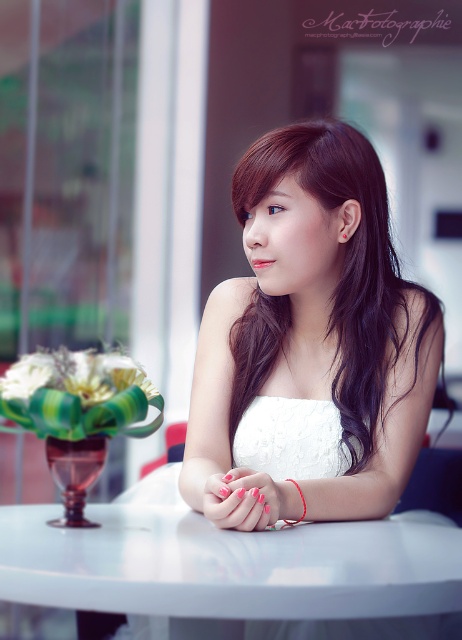
Question: Does white glossy table at center appear on the left side of red string bracelet at center?

Choices:
 (A) no
 (B) yes

Answer: (B)

Question: Does white glossy table at center have a smaller size compared to pink matte nails at center?

Choices:
 (A) yes
 (B) no

Answer: (B)

Question: Which point is closer to the camera taking this photo?

Choices:
 (A) (97, 586)
 (B) (286, 522)
 (C) (242, 330)

Answer: (A)

Question: Does pink matte nails at center come in front of red string bracelet at center?

Choices:
 (A) yes
 (B) no

Answer: (A)

Question: Based on their relative distances, which object is farther from the white glossy table at center?

Choices:
 (A) red string bracelet at center
 (B) brown silky hair at center

Answer: (B)

Question: Which of the following is the farthest from the observer?

Choices:
 (A) red string bracelet at center
 (B) pink matte nails at center

Answer: (A)